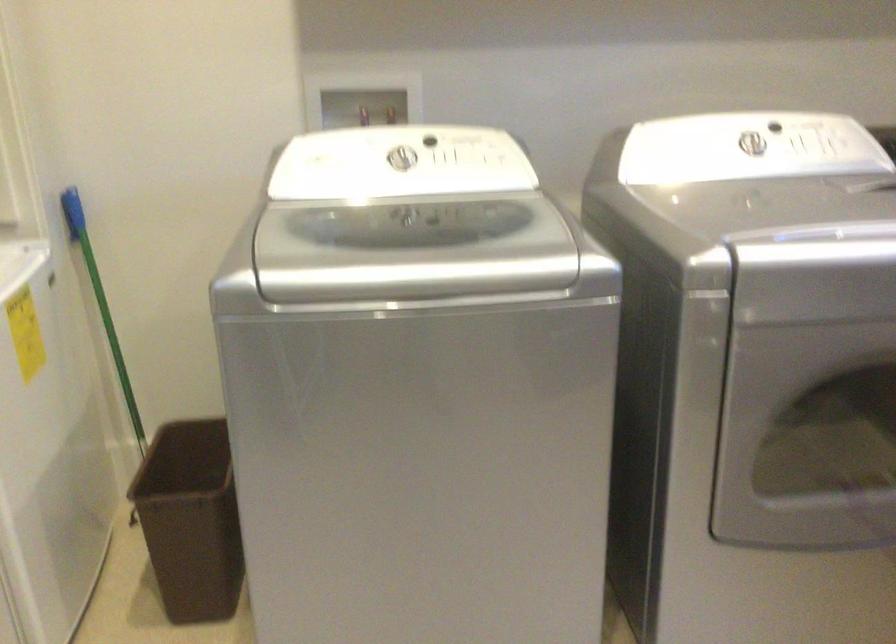
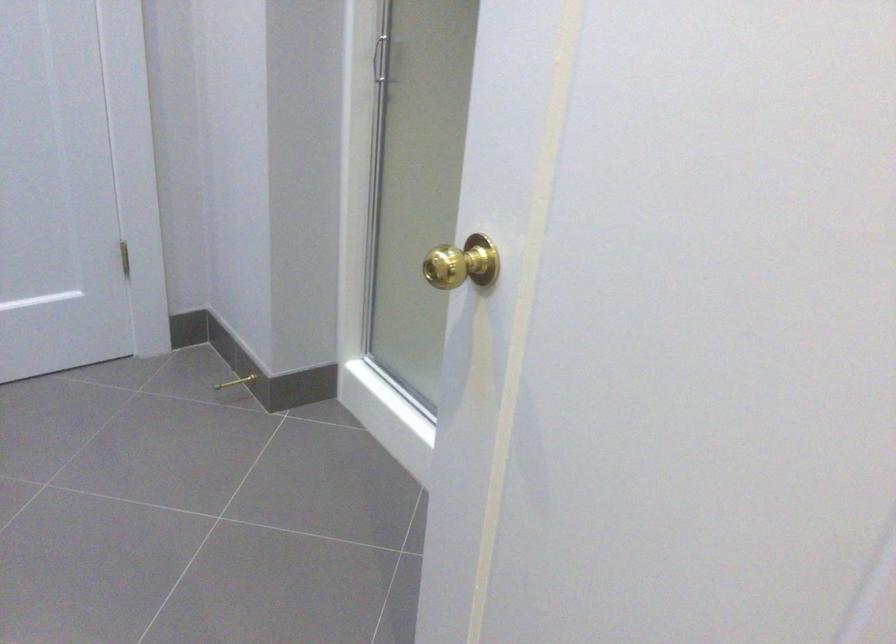
The first image is from the beginning of the video and the second image is from the end. How did the camera likely rotate when shooting the video?

The camera's rotation is toward left-down.